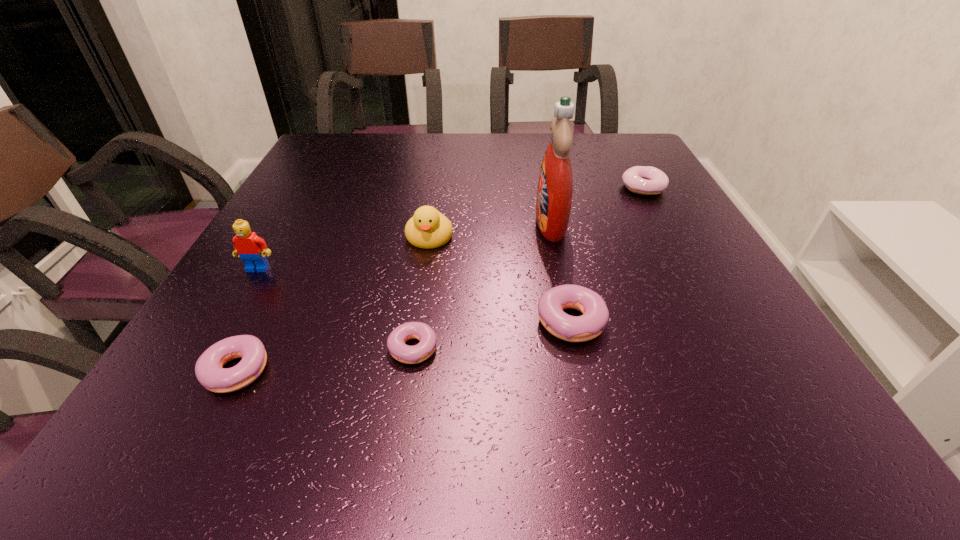
Find the location of a particular element. detergent is located at coordinates pyautogui.click(x=555, y=186).

Image resolution: width=960 pixels, height=540 pixels. In order to click on free space located 0.050m on the left of the second shortest object in this screenshot , I will do `click(173, 372)`.

The height and width of the screenshot is (540, 960). In order to click on vacant region located on the right of the shortest doughnut in this screenshot , I will do `click(540, 344)`.

Locate an element on the screen. Image resolution: width=960 pixels, height=540 pixels. free spot located 0.060m on the back of the third doughnut from left to right is located at coordinates (561, 273).

Where is `free region located on the face of the fifth shortest object`? Image resolution: width=960 pixels, height=540 pixels. free region located on the face of the fifth shortest object is located at coordinates (423, 278).

This screenshot has height=540, width=960. What are the coordinates of `free space located 0.090m on the face of the fourth nearest object` in the screenshot? It's located at (236, 305).

Where is `free space located 0.170m on the back of the farthest object`? Image resolution: width=960 pixels, height=540 pixels. free space located 0.170m on the back of the farthest object is located at coordinates (621, 148).

The image size is (960, 540). I want to click on blank space located 0.240m on the front surface of the tallest object, so click(428, 224).

Locate an element on the screen. vacant space located 0.340m on the front surface of the tallest object is located at coordinates (384, 224).

Find the location of a particular element. This screenshot has width=960, height=540. vacant space located on the front surface of the tallest object is located at coordinates (420, 224).